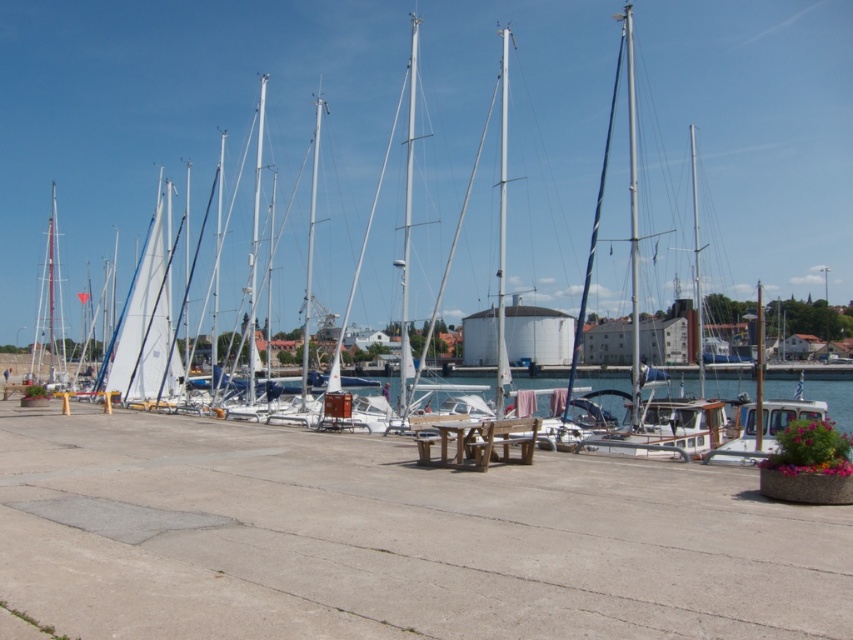
Does silver metallic mast at center have a greater height compared to white glossy mast at center?

Correct, silver metallic mast at center is much taller as white glossy mast at center.

Which of these two, silver metallic mast at center or white glossy mast at center, stands shorter?

white glossy mast at center

This screenshot has width=853, height=640. What do you see at coordinates (631, 216) in the screenshot?
I see `silver metallic mast at center` at bounding box center [631, 216].

You are a GUI agent. You are given a task and a screenshot of the screen. Output one action in this format:
    pyautogui.click(x=<x>, y=<y>)
    Task: Click on the silver metallic mast at center
    The image size is (853, 640).
    Given the screenshot: What is the action you would take?
    pyautogui.click(x=631, y=216)

How distant is wooden picnic table at center from white glossy mast at center?

38.36 meters

Who is positioned more to the left, wooden picnic table at center or white glossy mast at center?

Positioned to the left is white glossy mast at center.

Does point (518, 433) lie in front of point (410, 83)?

Yes, point (518, 433) is in front of point (410, 83).

Identify the location of wooden picnic table at center. (479, 442).

Looking at this image, does white matte sailboat at center have a greater height compared to white glossy mast at center?

Indeed, white matte sailboat at center has a greater height compared to white glossy mast at center.

Between white matte sailboat at center and white glossy mast at center, which one is positioned lower?

Positioned lower is white glossy mast at center.

The image size is (853, 640). I want to click on white matte sailboat at center, so click(294, 124).